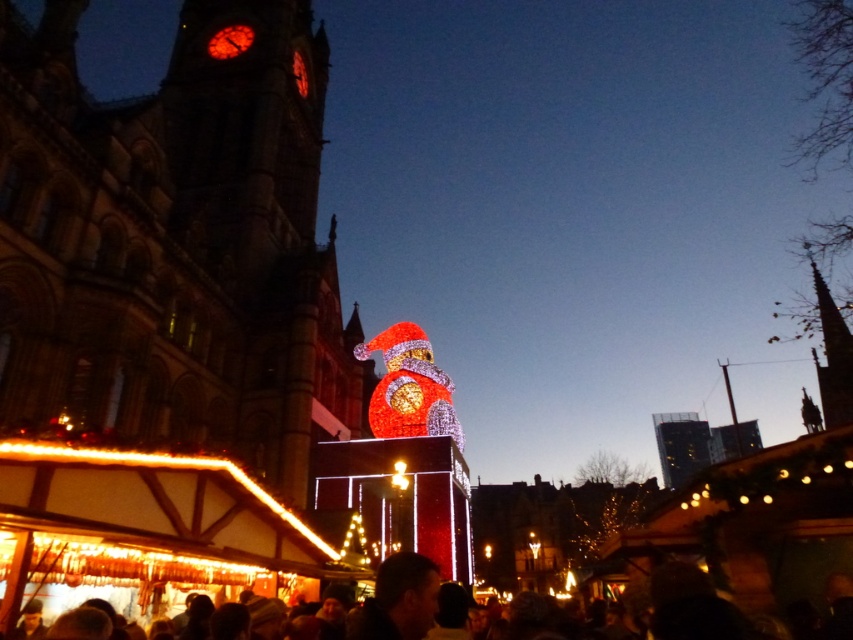
You are standing at the dark brown hair at lower center in the scene. You want to walk straight ahead towards the stone clock tower at upper left. How far will you have to walk to reach it?

The stone clock tower at upper left is 58.31 meters away from dark brown hair at lower center, so you will have to walk 58.31 meters to reach it.

You are standing at the entrance of the Christmas market and see the stone clock tower at upper left and the dark brown hair at lower center. Which object is positioned higher in the image?

The stone clock tower at upper left is located above the dark brown hair at lower center, so it is positioned higher in the image.